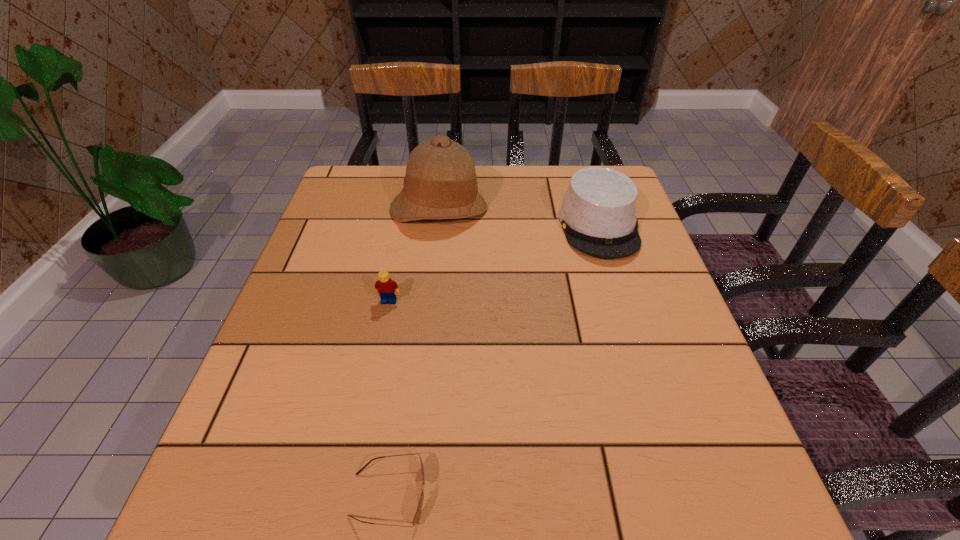
This screenshot has width=960, height=540. What are the coordinates of `blank region between the right hat and the shortest object` in the screenshot? It's located at (493, 360).

The image size is (960, 540). I want to click on empty space between the left hat and the right hat, so click(519, 217).

Image resolution: width=960 pixels, height=540 pixels. Identify the location of free space between the left hat and the second nearest object. (414, 255).

Locate an element on the screen. The width and height of the screenshot is (960, 540). free space between the left hat and the shortest object is located at coordinates pos(414,352).

Where is `empty space that is in between the second tallest object and the left hat`? empty space that is in between the second tallest object and the left hat is located at coordinates (519, 217).

The height and width of the screenshot is (540, 960). Identify the location of free space between the rightmost object and the sunglasses. (493, 360).

Where is `free space between the tallest object and the rightmost object`? The height and width of the screenshot is (540, 960). free space between the tallest object and the rightmost object is located at coordinates (519, 217).

At what (x,y) coordinates should I click in order to perform the action: click on free point between the second nearest object and the sunglasses. Please return your answer as a coordinate pair (x, y). This screenshot has height=540, width=960. Looking at the image, I should click on (389, 398).

The width and height of the screenshot is (960, 540). Find the location of `free spot between the Lego and the nearest object`. free spot between the Lego and the nearest object is located at coordinates (389, 398).

The image size is (960, 540). I want to click on free space between the third farthest object and the rightmost object, so click(x=493, y=263).